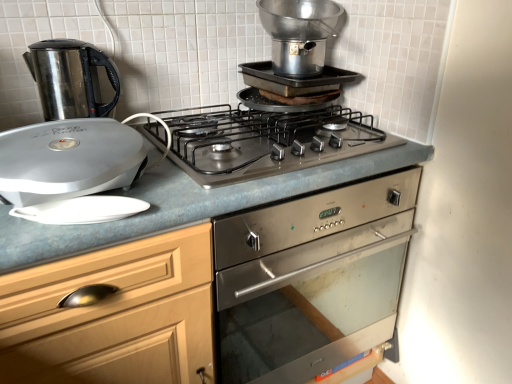
Question: Is satin silver gas stove at center inside the boundaries of metallic silver pot at upper center, marked as the third kitchen appliance in a left-to-right arrangement, or outside?

Choices:
 (A) outside
 (B) inside

Answer: (A)

Question: Looking at the image, does satin silver gas stove at center seem bigger or smaller compared to metallic silver pot at upper center, marked as the third kitchen appliance in a left-to-right arrangement?

Choices:
 (A) small
 (B) big

Answer: (B)

Question: Estimate the real-world distances between objects in this image. Which object is farther from the metallic silver pot at upper center, marked as the third kitchen appliance in a left-to-right arrangement?

Choices:
 (A) silver metallic george foreman grill at left, the 2th kitchen appliance positioned from the right
 (B) blue laminate countertop at center
 (C) satin silver gas stove at center
 (D) stainless steel kettle at left, acting as the third kitchen appliance starting from the right

Answer: (A)

Question: Which object is the closest to the metallic silver pot at upper center, which appears as the 1th kitchen appliance when viewed from the right?

Choices:
 (A) stainless steel kettle at left, acting as the third kitchen appliance starting from the right
 (B) silver metallic george foreman grill at left, acting as the 2th kitchen appliance starting from the left
 (C) satin silver gas stove at center
 (D) blue laminate countertop at center

Answer: (C)